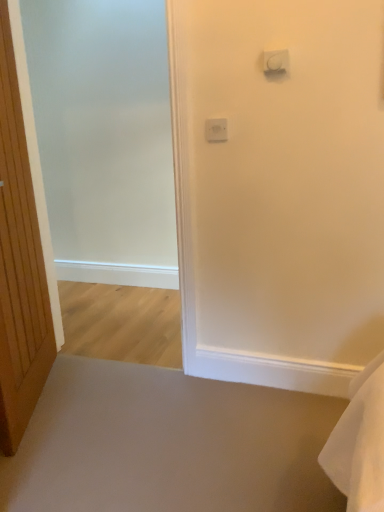
The image size is (384, 512). What do you see at coordinates (216, 130) in the screenshot?
I see `white plastic light switch at upper center, the 1th light switch from the bottom` at bounding box center [216, 130].

The height and width of the screenshot is (512, 384). What do you see at coordinates (276, 61) in the screenshot? I see `white plastic light switch at upper center, which is the second light switch in back-to-front order` at bounding box center [276, 61].

This screenshot has height=512, width=384. Describe the element at coordinates (19, 265) in the screenshot. I see `wooden door at left` at that location.

Identify the location of white plastic light switch at upper center, positioned as the second light switch in top-to-bottom order. This screenshot has width=384, height=512. (216, 130).

From the image's perspective, is white plastic light switch at upper center, the 2th light switch viewed from the left, above or below wooden door at left?

Based on their image positions, white plastic light switch at upper center, the 2th light switch viewed from the left, is located above wooden door at left.

Which object is thinner, white plastic light switch at upper center, the 1th light switch from the right, or wooden door at left?

white plastic light switch at upper center, the 1th light switch from the right.

Can you see white plastic light switch at upper center, the first light switch when ordered from front to back, touching wooden door at left?

No, white plastic light switch at upper center, the first light switch when ordered from front to back, is not with wooden door at left.

Does white plastic light switch at upper center, the 2th light switch viewed from the left, have a lesser height compared to wooden door at left?

Indeed, white plastic light switch at upper center, the 2th light switch viewed from the left, has a lesser height compared to wooden door at left.

Considering the relative positions of frosted glass screen door at left and white plastic light switch at upper center, the 1th light switch from the bottom, in the image provided, is frosted glass screen door at left to the left or to the right of white plastic light switch at upper center, the 1th light switch from the bottom,?

frosted glass screen door at left is positioned on white plastic light switch at upper center, the 1th light switch from the bottom,'s left side.

From the image's perspective, is frosted glass screen door at left above white plastic light switch at upper center, the second light switch in the front-to-back sequence?

No, from the image's perspective, frosted glass screen door at left is not on top of white plastic light switch at upper center, the second light switch in the front-to-back sequence.

Is frosted glass screen door at left bigger than white plastic light switch at upper center, the second light switch when ordered from right to left?

Yes.

Which is more to the left, white plastic light switch at upper center, which is the second light switch in back-to-front order, or white plastic light switch at upper center, the second light switch in the front-to-back sequence?

white plastic light switch at upper center, the second light switch in the front-to-back sequence.

From the image's perspective, between white plastic light switch at upper center, the 1th light switch from the right, and white plastic light switch at upper center, positioned as the second light switch in top-to-bottom order, who is located below?

From the image's view, white plastic light switch at upper center, positioned as the second light switch in top-to-bottom order, is below.

Who is shorter, white plastic light switch at upper center, marked as the first light switch in a top-to-bottom arrangement, or white plastic light switch at upper center, positioned as the second light switch in top-to-bottom order?

white plastic light switch at upper center, marked as the first light switch in a top-to-bottom arrangement.

Could you tell me if wooden door at left is facing white plastic light switch at upper center, the second light switch when ordered from right to left?

Yes, wooden door at left is turned towards white plastic light switch at upper center, the second light switch when ordered from right to left.

From a real-world perspective, which object stands above the other?

From a 3D spatial view, white plastic light switch at upper center, the second light switch when ordered from right to left, is above.

Is wooden door at left positioned behind white plastic light switch at upper center, the 1th light switch positioned from the left?

No.

Is wooden door at left positioned far away from white plastic light switch at upper center, the second light switch when ordered from right to left?

wooden door at left is far away from white plastic light switch at upper center, the second light switch when ordered from right to left.

Is white plastic light switch at upper center, the 1th light switch from the bottom, at the right side of frosted glass screen door at left?

Yes, white plastic light switch at upper center, the 1th light switch from the bottom, is to the right of frosted glass screen door at left.

What are the coordinates of `light switch behind the frosted glass screen door at left` in the screenshot? It's located at (216, 130).

Is white plastic light switch at upper center, positioned as the second light switch in top-to-bottom order, shorter than frosted glass screen door at left?

Indeed, white plastic light switch at upper center, positioned as the second light switch in top-to-bottom order, has a lesser height compared to frosted glass screen door at left.

From the image's perspective, is white plastic light switch at upper center, the 1th light switch from the bottom, above frosted glass screen door at left?

Yes, from the image's perspective, white plastic light switch at upper center, the 1th light switch from the bottom, is on top of frosted glass screen door at left.

Consider the image. What's the angular difference between frosted glass screen door at left and white plastic light switch at upper center, the first light switch when ordered from front to back,'s facing directions?

0.151 degrees separate the facing orientations of frosted glass screen door at left and white plastic light switch at upper center, the first light switch when ordered from front to back.

Considering the points (69, 198) and (280, 66), which point is in front, point (69, 198) or point (280, 66)?

The point (280, 66) is in front.

In order to click on screen door below the white plastic light switch at upper center, which is the second light switch in back-to-front order (from the image's perspective) in this screenshot , I will do `click(104, 138)`.

Considering the relative positions of frosted glass screen door at left and white plastic light switch at upper center, the 2th light switch viewed from the left, in the image provided, is frosted glass screen door at left to the left of white plastic light switch at upper center, the 2th light switch viewed from the left, from the viewer's perspective?

Yes, frosted glass screen door at left is to the left of white plastic light switch at upper center, the 2th light switch viewed from the left.

Is wooden door at left with white plastic light switch at upper center, which is the second light switch in back-to-front order?

No, wooden door at left is not making contact with white plastic light switch at upper center, which is the second light switch in back-to-front order.

From the image's perspective, would you say wooden door at left is shown under white plastic light switch at upper center, the first light switch when ordered from front to back?

Yes.

Does point (48, 370) lie behind point (266, 72)?

Yes, it is behind point (266, 72).

Which object is closer to the camera taking this photo, wooden door at left or white plastic light switch at upper center, which is the second light switch in back-to-front order?

wooden door at left is more forward.

From the image's perspective, count 2nd light switchs upward from the wooden door at left and point to it. Please provide its 2D coordinates.

[(276, 61)]

Find the location of a particular element. screen door that is below the white plastic light switch at upper center, the second light switch when ordered from right to left (from the image's perspective) is located at coordinates [104, 138].

Estimate the real-world distances between objects in this image. Which object is closer to wooden door at left, white plastic light switch at upper center, marked as the first light switch in a top-to-bottom arrangement, or frosted glass screen door at left?

The object closer to wooden door at left is frosted glass screen door at left.

Which object lies further to the anchor point frosted glass screen door at left, white plastic light switch at upper center, the first light switch when ordered from front to back, or wooden door at left?

Based on the image, white plastic light switch at upper center, the first light switch when ordered from front to back, appears to be further to frosted glass screen door at left.

From the image, which object appears to be farther from frosted glass screen door at left, wooden door at left or white plastic light switch at upper center, marked as the first light switch in a top-to-bottom arrangement?

white plastic light switch at upper center, marked as the first light switch in a top-to-bottom arrangement.

From the image, which object appears to be nearer to white plastic light switch at upper center, the second light switch when ordered from right to left, wooden door at left or frosted glass screen door at left?

The object closer to white plastic light switch at upper center, the second light switch when ordered from right to left, is wooden door at left.

Estimate the real-world distances between objects in this image. Which object is closer to white plastic light switch at upper center, the first light switch when ordered from front to back, white plastic light switch at upper center, the second light switch in the front-to-back sequence, or wooden door at left?

Based on the image, white plastic light switch at upper center, the second light switch in the front-to-back sequence, appears to be nearer to white plastic light switch at upper center, the first light switch when ordered from front to back.

Considering their positions, is white plastic light switch at upper center, which is counted as the second light switch, starting from the bottom, positioned closer to frosted glass screen door at left than white plastic light switch at upper center, the 1th light switch positioned from the left?

Based on the image, white plastic light switch at upper center, the 1th light switch positioned from the left, appears to be nearer to frosted glass screen door at left.

Looking at the image, which one is located further to frosted glass screen door at left, wooden door at left or white plastic light switch at upper center, the 1th light switch positioned from the left?

Among the two, white plastic light switch at upper center, the 1th light switch positioned from the left, is located further to frosted glass screen door at left.

Which object lies nearer to the anchor point white plastic light switch at upper center, positioned as the second light switch in top-to-bottom order, frosted glass screen door at left or wooden door at left?

wooden door at left is closer to white plastic light switch at upper center, positioned as the second light switch in top-to-bottom order.

Locate an element on the screen. Image resolution: width=384 pixels, height=512 pixels. screen door located between wooden door at left and white plastic light switch at upper center, the 1th light switch from the right, in the left-right direction is located at coordinates (104, 138).

Where is `screen door situated between wooden door at left and white plastic light switch at upper center, the second light switch in the front-to-back sequence, from left to right`? This screenshot has width=384, height=512. screen door situated between wooden door at left and white plastic light switch at upper center, the second light switch in the front-to-back sequence, from left to right is located at coordinates pos(104,138).

Where is `light switch between frosted glass screen door at left and white plastic light switch at upper center, the 1th light switch from the right, in the horizontal direction`? light switch between frosted glass screen door at left and white plastic light switch at upper center, the 1th light switch from the right, in the horizontal direction is located at coordinates (216, 130).

Identify the location of light switch between wooden door at left and white plastic light switch at upper center, marked as the first light switch in a top-to-bottom arrangement, in the horizontal direction. Image resolution: width=384 pixels, height=512 pixels. [216, 130].